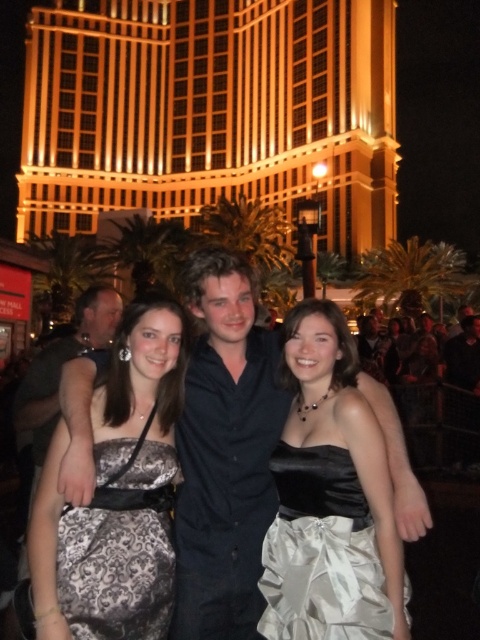
You are a photographer trying to frame the golden glass building at upper center and the silver satin dress at center in a single shot. Based on their sizes, which object should you focus on to ensure both are visible without cropping?

The golden glass building at upper center might be wider than the silver satin dress at center, so focusing on the building would allow both to fit within the frame as the dress is narrower.

You are a photographer trying to capture a photo of the golden glass building at upper center and the silver satin dress at center. Which object in the scene is bigger?

The golden glass building at upper center is larger in size compared to the silver satin dress at center.

You are a photographer trying to capture the golden glass building at upper center and the satin dress at center in a single shot. Based on their sizes in the image, which object would appear larger in the final photograph?

The golden glass building at upper center appears much larger in the photograph than the satin dress at center because it is described as being much taller.